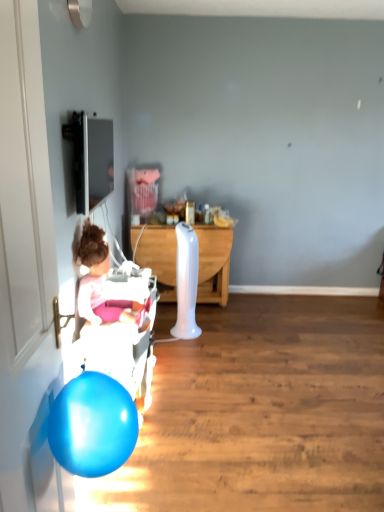
Question: Considering the relative sizes of pink fabric at left and white wood desk at center in the image provided, is pink fabric at left wider than white wood desk at center?

Choices:
 (A) no
 (B) yes

Answer: (A)

Question: Is pink fabric at left at the right side of white wood desk at center?

Choices:
 (A) no
 (B) yes

Answer: (A)

Question: Does pink fabric at left have a larger size compared to white wood desk at center?

Choices:
 (A) yes
 (B) no

Answer: (B)

Question: From the image's perspective, is pink fabric at left located above white wood desk at center?

Choices:
 (A) no
 (B) yes

Answer: (A)

Question: Is pink fabric at left smaller than white wood desk at center?

Choices:
 (A) yes
 (B) no

Answer: (A)

Question: Would you say pink fabric at left is to the left or to the right of white wood desk at center in the picture?

Choices:
 (A) left
 (B) right

Answer: (A)

Question: From the image's perspective, relative to white wood desk at center, is pink fabric at left above or below?

Choices:
 (A) below
 (B) above

Answer: (A)

Question: Is pink fabric at left spatially inside white wood desk at center, or outside of it?

Choices:
 (A) inside
 (B) outside

Answer: (B)

Question: Is point (97, 236) positioned closer to the camera than point (211, 268)?

Choices:
 (A) closer
 (B) farther

Answer: (A)

Question: In terms of width, does white wood desk at center look wider or thinner when compared to pink fabric at left?

Choices:
 (A) thin
 (B) wide

Answer: (B)

Question: Based on their positions, is white wood desk at center located to the left or right of pink fabric at left?

Choices:
 (A) left
 (B) right

Answer: (B)

Question: Is white wood desk at center bigger or smaller than pink fabric at left?

Choices:
 (A) big
 (B) small

Answer: (A)

Question: Relative to pink fabric at left, is white wood desk at center in front or behind?

Choices:
 (A) behind
 (B) front

Answer: (A)

Question: Considering the positions of white plastic baby carriage at left and pink fabric at left in the image, is white plastic baby carriage at left wider or thinner than pink fabric at left?

Choices:
 (A) thin
 (B) wide

Answer: (A)

Question: Is white plastic baby carriage at left bigger or smaller than pink fabric at left?

Choices:
 (A) big
 (B) small

Answer: (A)